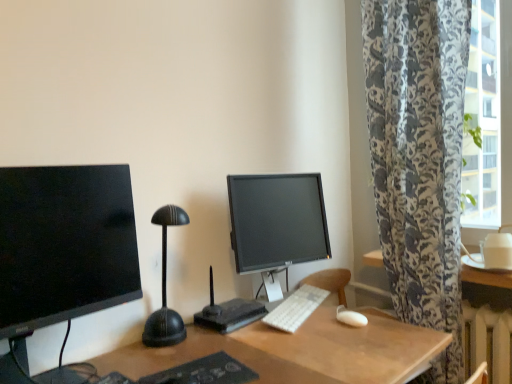
Question: Is white matte mouse at lower right to the left of matte black monitor at left, which is the second computer monitor in back-to-front order, from the viewer's perspective?

Choices:
 (A) yes
 (B) no

Answer: (B)

Question: Can you confirm if white matte mouse at lower right is shorter than matte black monitor at left, which appears as the 1th computer monitor when viewed from the left?

Choices:
 (A) yes
 (B) no

Answer: (A)

Question: Is matte black monitor at left, which appears as the 1th computer monitor when viewed from the left, a part of white matte mouse at lower right?

Choices:
 (A) yes
 (B) no

Answer: (B)

Question: From a real-world perspective, is white matte mouse at lower right physically above matte black monitor at left, which is the second computer monitor in back-to-front order?

Choices:
 (A) no
 (B) yes

Answer: (A)

Question: Is matte black monitor at left, which is the second computer monitor in back-to-front order, at the back of white matte mouse at lower right?

Choices:
 (A) yes
 (B) no

Answer: (B)

Question: From the image's perspective, would you say white matte mouse at lower right is shown under matte black monitor at left, acting as the 1th computer monitor starting from the front?

Choices:
 (A) no
 (B) yes

Answer: (B)

Question: Can you see white plastic keyboard at center touching matte black monitor at left, which is the second computer monitor in back-to-front order?

Choices:
 (A) no
 (B) yes

Answer: (A)

Question: Can you confirm if white plastic keyboard at center is wider than matte black monitor at left, which is the second computer monitor in back-to-front order?

Choices:
 (A) no
 (B) yes

Answer: (A)

Question: From a real-world perspective, is white plastic keyboard at center physically above matte black monitor at left, acting as the 2th computer monitor starting from the right?

Choices:
 (A) no
 (B) yes

Answer: (A)

Question: Would you say white plastic keyboard at center contains matte black monitor at left, acting as the 1th computer monitor starting from the front?

Choices:
 (A) yes
 (B) no

Answer: (B)

Question: Does white plastic keyboard at center come behind matte black monitor at left, which is the second computer monitor in back-to-front order?

Choices:
 (A) no
 (B) yes

Answer: (B)

Question: Is white plastic keyboard at center completely or partially outside of matte black monitor at left, acting as the 2th computer monitor starting from the right?

Choices:
 (A) yes
 (B) no

Answer: (A)

Question: Is black plastic router at center not inside white plastic keyboard at center?

Choices:
 (A) yes
 (B) no

Answer: (A)